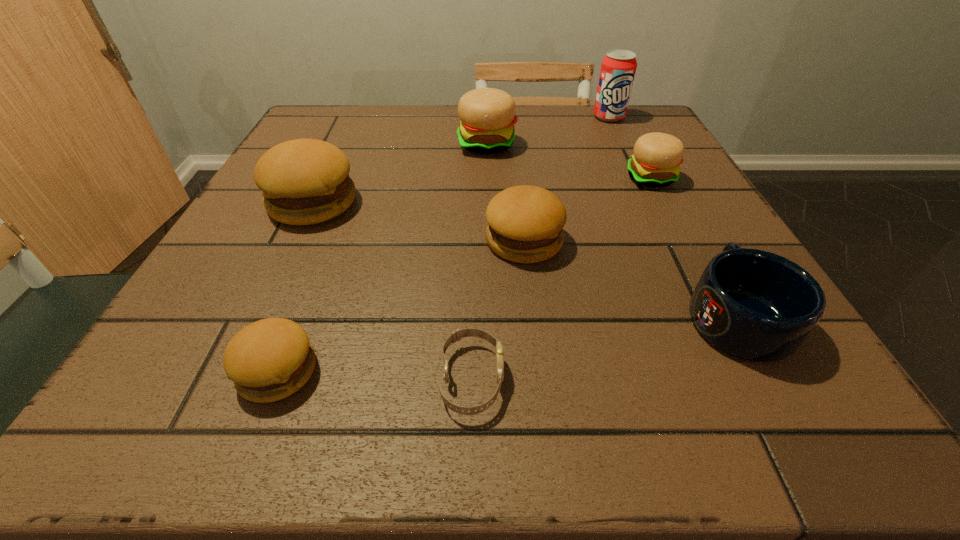
Image resolution: width=960 pixels, height=540 pixels. What are the coordinates of `the second shortest object` in the screenshot? It's located at (268, 360).

Locate an element on the screen. The width and height of the screenshot is (960, 540). watch is located at coordinates (469, 332).

Where is `vacant region located 0.160m on the surface of the tallest object`? vacant region located 0.160m on the surface of the tallest object is located at coordinates (628, 158).

This screenshot has height=540, width=960. Identify the location of vacant space situated on the left of the bigger beige hamburger. (385, 144).

Where is `blank space located 0.150m on the back of the biggest brown hamburger`? blank space located 0.150m on the back of the biggest brown hamburger is located at coordinates (x=341, y=144).

Image resolution: width=960 pixels, height=540 pixels. I want to click on vacant space located on the back of the rightmost brown hamburger, so click(x=514, y=145).

In order to click on vacant space located on the front of the nearer beige hamburger in this screenshot , I will do `click(678, 230)`.

You are a GUI agent. You are given a task and a screenshot of the screen. Output one action in this format:
    pyautogui.click(x=<x>, y=<y>)
    Task: Click on the free location located 0.140m with the handle on the side of the blue mug
    
    Given the screenshot: What is the action you would take?
    pyautogui.click(x=683, y=220)

Find the location of `free spot located with the handle on the side of the blue mug`. free spot located with the handle on the side of the blue mug is located at coordinates (691, 234).

The height and width of the screenshot is (540, 960). In order to click on vacant space located 0.260m with the handle on the side of the blue mug in this screenshot , I will do `click(662, 184)`.